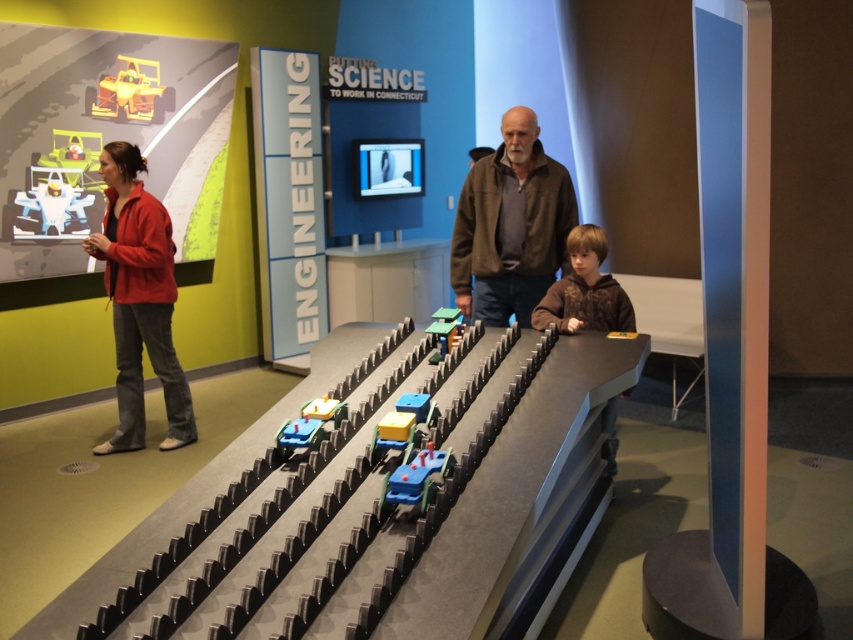
Question: Which point is closer to the camera?

Choices:
 (A) matte red jacket at left
 (B) white glossy race car at upper left

Answer: (A)

Question: Which object appears closest to the camera in this image?

Choices:
 (A) yellow plastic toy car at upper left
 (B) brown suede jacket at center
 (C) wooden toy train at center
 (D) brown fuzzy hoodie at center

Answer: (C)

Question: Which point is farther to the camera?

Choices:
 (A) (134, 102)
 (B) (21, 211)

Answer: (A)

Question: Can you confirm if matte red jacket at left is positioned to the left of blue plastic toy car at center?

Choices:
 (A) no
 (B) yes

Answer: (B)

Question: Observing the image, what is the correct spatial positioning of wooden toy train at center in reference to white glossy race car at upper left?

Choices:
 (A) above
 (B) below

Answer: (B)

Question: Is matte red jacket at left below brown fuzzy hoodie at center?

Choices:
 (A) yes
 (B) no

Answer: (A)